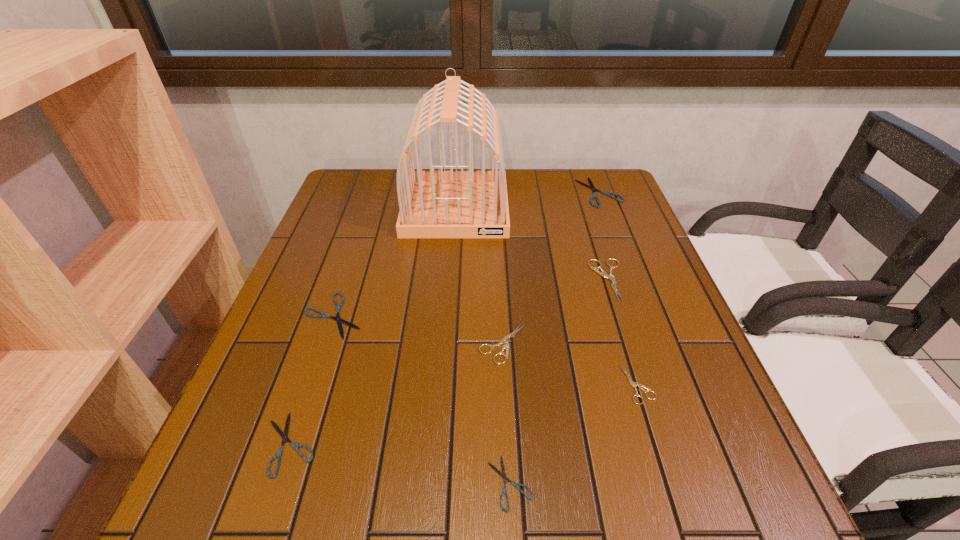
The height and width of the screenshot is (540, 960). Find the location of `free location at the far left corner of the desktop`. free location at the far left corner of the desktop is located at coordinates (352, 183).

Locate an element on the screen. empty space between the leftmost beige shears and the third biggest black shears is located at coordinates (396, 394).

Find the location of a particular element. The height and width of the screenshot is (540, 960). vacant space that is in between the birdcage and the second biggest black shears is located at coordinates (395, 261).

At what (x,y) coordinates should I click in order to perform the action: click on vacant space that's between the tallest shears and the second smallest beige shears. Please return your answer as a coordinate pair (x, y). Image resolution: width=960 pixels, height=540 pixels. Looking at the image, I should click on (556, 312).

This screenshot has width=960, height=540. In order to click on free spot between the nearest beige shears and the third smallest black shears in this screenshot , I will do `click(486, 350)`.

Find the location of `empty space that is in between the nearest beige shears and the leftmost beige shears`. empty space that is in between the nearest beige shears and the leftmost beige shears is located at coordinates (570, 364).

You are a GUI agent. You are given a task and a screenshot of the screen. Output one action in this format:
    pyautogui.click(x=<x>, y=<y>)
    Task: Click on the vacant area between the farthest shears and the smallest beige shears
    
    Given the screenshot: What is the action you would take?
    pyautogui.click(x=619, y=288)

I want to click on empty location between the tallest object and the biggest black shears, so click(x=528, y=200).

Image resolution: width=960 pixels, height=540 pixels. I want to click on empty space between the third nearest black shears and the tallest object, so click(395, 261).

Find the location of a particular element. This screenshot has width=960, height=540. free space that is in between the fifth farthest shears and the second biggest beige shears is located at coordinates (570, 364).